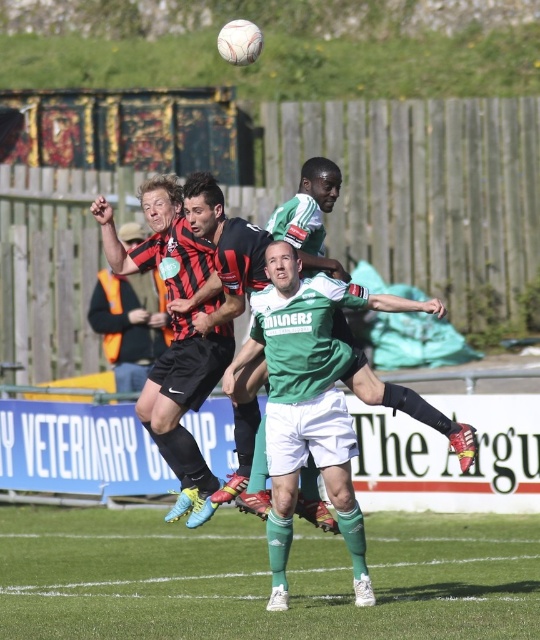
Between black matte shorts at center and white matte soccer player at center, which one appears on the right side from the viewer's perspective?

white matte soccer player at center is more to the right.

Is black matte shorts at center above white matte soccer player at center?

Actually, black matte shorts at center is below white matte soccer player at center.

Which is behind, point (204, 300) or point (192, 180)?

Point (204, 300)

Locate an element on the screen. The image size is (540, 640). black matte shorts at center is located at coordinates (176, 332).

Is point (369, 620) behind point (104, 291)?

No, (369, 620) is in front of (104, 291).

Is green grass at center wider than matte black shorts at center?

Yes.

Measure the distance between point (538, 577) and camera.

Point (538, 577) and camera are 76.03 feet apart from each other.

What are the coordinates of `green grass at center` in the screenshot? It's located at (262, 577).

Between point (192, 300) and point (116, 310), which one is positioned behind?

Point (116, 310)

Is point (190, 275) more distant than point (119, 321)?

No, it is not.

Find the location of `black matte shorts at center`. black matte shorts at center is located at coordinates (176, 332).